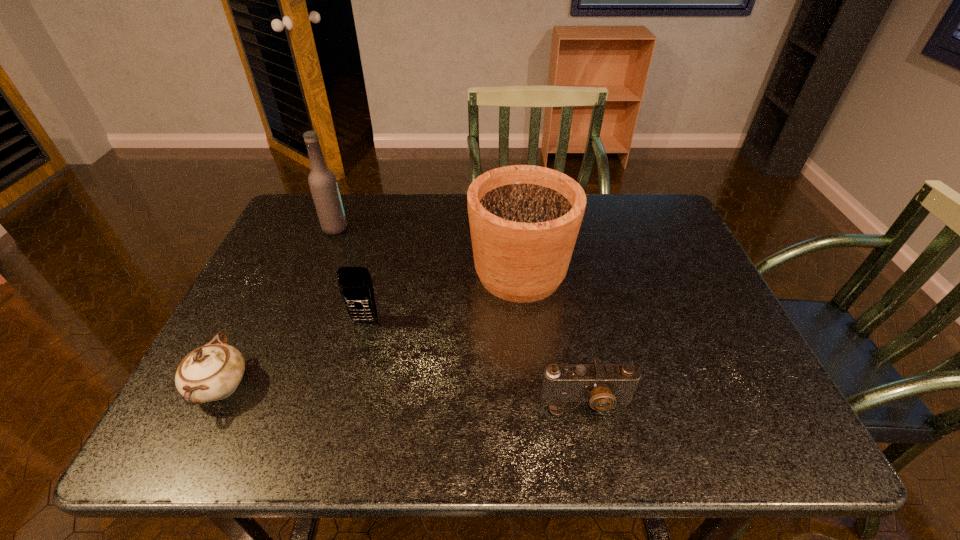
The height and width of the screenshot is (540, 960). Find the location of `empty space between the shortest object and the leftmost object`. empty space between the shortest object and the leftmost object is located at coordinates (404, 394).

Image resolution: width=960 pixels, height=540 pixels. In order to click on empty location between the farthest object and the shortest object in this screenshot , I will do `click(461, 314)`.

At what (x,y) coordinates should I click in order to perform the action: click on empty location between the leftmost object and the cellular telephone. Please return your answer as a coordinate pair (x, y). The image size is (960, 540). Looking at the image, I should click on (293, 354).

Locate which object is the third closest to the camera. Please provide its 2D coordinates. Your answer should be formatted as a tuple, i.e. [(x, y)], where the tuple contains the x and y coordinates of a point satisfying the conditions above.

[(212, 372)]

The height and width of the screenshot is (540, 960). I want to click on the third closest object to the fourth nearest object, so click(x=322, y=181).

The image size is (960, 540). What are the coordinates of `free space that satisfies the following two spatial constraints: 1. on the side of the fourth shortest object with the label; 2. on the right side of the beer bottle` in the screenshot? It's located at (317, 273).

At what (x,y) coordinates should I click in order to perform the action: click on free region that satisfies the following two spatial constraints: 1. on the back side of the flowerpot; 2. on the right side of the leftmost object. Please return your answer as a coordinate pair (x, y). Looking at the image, I should click on (277, 273).